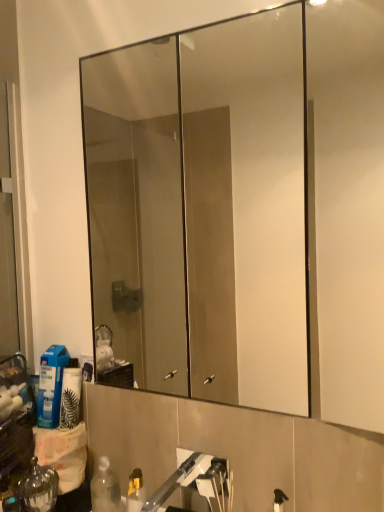
What is the approximate height of brushed metal faucet at lower center?

brushed metal faucet at lower center is 4.20 inches tall.

Describe the element at coordinates (39, 487) in the screenshot. The height and width of the screenshot is (512, 384). I see `shiny metallic bottle at lower left` at that location.

Find the location of a particular element. clear glass mirror at upper center is located at coordinates (203, 210).

Can you confirm if clear glass mirror at upper center is thinner than shiny metallic bottle at lower left?

Correct, the width of clear glass mirror at upper center is less than that of shiny metallic bottle at lower left.

From a real-world perspective, is clear glass mirror at upper center positioned above or below shiny metallic bottle at lower left?

From a real-world perspective, clear glass mirror at upper center is physically above shiny metallic bottle at lower left.

Locate an element on the screen. This screenshot has height=512, width=384. mirror above the shiny metallic bottle at lower left (from the image's perspective) is located at coordinates (203, 210).

From a real-world perspective, is shiny metallic bottle at lower left above or below brushed metal faucet at lower center?

shiny metallic bottle at lower left is situated lower than brushed metal faucet at lower center in the real world.

Looking at this image, what's the angular difference between shiny metallic bottle at lower left and brushed metal faucet at lower center's facing directions?

The facing directions of shiny metallic bottle at lower left and brushed metal faucet at lower center are 2.61 degrees apart.

Based on the photo, which object is positioned more to the right, shiny metallic bottle at lower left or brushed metal faucet at lower center?

From the viewer's perspective, brushed metal faucet at lower center appears more on the right side.

Is shiny metallic bottle at lower left bigger or smaller than brushed metal faucet at lower center?

shiny metallic bottle at lower left is smaller than brushed metal faucet at lower center.

Considering the relative sizes of brushed metal faucet at lower center and blue plastic bottle at lower left in the image provided, is brushed metal faucet at lower center taller than blue plastic bottle at lower left?

No.

From a real-world perspective, which is physically below, brushed metal faucet at lower center or blue plastic bottle at lower left?

brushed metal faucet at lower center, from a real-world perspective.

Which object is closer to the camera, brushed metal faucet at lower center or blue plastic bottle at lower left?

brushed metal faucet at lower center.

Based on their sizes in the image, would you say brushed metal faucet at lower center is bigger or smaller than blue plastic bottle at lower left?

In the image, brushed metal faucet at lower center appears to be larger than blue plastic bottle at lower left.

Find the location of a particular element. Image resolution: width=384 pixels, height=512 pixels. faucet lying below the clear glass mirror at upper center (from the image's perspective) is located at coordinates (178, 479).

In terms of height, does clear glass mirror at upper center look taller or shorter compared to brushed metal faucet at lower center?

In the image, clear glass mirror at upper center appears to be taller than brushed metal faucet at lower center.

From the picture: Can you tell me how much clear glass mirror at upper center and brushed metal faucet at lower center differ in facing direction?

The angular difference between clear glass mirror at upper center and brushed metal faucet at lower center is 1.91 degrees.

From a real-world perspective, which object stands above the other?

From a 3D spatial view, clear glass mirror at upper center is above.

Who is taller, brushed metal faucet at lower center or shiny metallic bottle at lower left?

Standing taller between the two is shiny metallic bottle at lower left.

Looking at this image, is brushed metal faucet at lower center positioned far away from shiny metallic bottle at lower left?

That's not correct — brushed metal faucet at lower center is a little close to shiny metallic bottle at lower left.

You are a GUI agent. You are given a task and a screenshot of the screen. Output one action in this format:
    pyautogui.click(x=<x>, y=<y>)
    Task: Click on the bottle below the brushed metal faucet at lower center (from a real-world perspective)
    The image size is (384, 512).
    Given the screenshot: What is the action you would take?
    pyautogui.click(x=39, y=487)

Which is correct: blue plastic bottle at lower left is inside clear glass mirror at upper center, or outside of it?

blue plastic bottle at lower left cannot be found inside clear glass mirror at upper center.

Does point (61, 369) appear closer or farther from the camera than point (118, 57)?

Point (61, 369) appears to be closer to the viewer than point (118, 57).

Considering the relative positions of blue plastic bottle at lower left and clear glass mirror at upper center in the image provided, is blue plastic bottle at lower left behind clear glass mirror at upper center?

Yes, blue plastic bottle at lower left is behind clear glass mirror at upper center.

Where is `cleaning product that is behind the clear glass mirror at upper center`? cleaning product that is behind the clear glass mirror at upper center is located at coordinates (51, 385).

The image size is (384, 512). In order to click on cleaning product located underneath the clear glass mirror at upper center (from a real-world perspective) in this screenshot , I will do `click(51, 385)`.

Could you tell me if clear glass mirror at upper center is turned towards blue plastic bottle at lower left?

No, clear glass mirror at upper center is not turned towards blue plastic bottle at lower left.

In terms of height, does clear glass mirror at upper center look taller or shorter compared to blue plastic bottle at lower left?

Considering their sizes, clear glass mirror at upper center has more height than blue plastic bottle at lower left.

From a real-world perspective, which object rests below the other?

blue plastic bottle at lower left.

Locate an element on the screen. The height and width of the screenshot is (512, 384). mirror on the right of shiny metallic bottle at lower left is located at coordinates (x=203, y=210).

Where is `bottle located below the brushed metal faucet at lower center (from the image's perspective)`? This screenshot has height=512, width=384. bottle located below the brushed metal faucet at lower center (from the image's perspective) is located at coordinates (39, 487).

Based on their spatial positions, is shiny metallic bottle at lower left or brushed metal faucet at lower center closer to clear glass mirror at upper center?

Based on the image, brushed metal faucet at lower center appears to be nearer to clear glass mirror at upper center.

From the image, which object appears to be nearer to blue plastic bottle at lower left, brushed metal faucet at lower center or shiny metallic bottle at lower left?

shiny metallic bottle at lower left.

Looking at the image, which one is located closer to shiny metallic bottle at lower left, blue plastic bottle at lower left or clear glass mirror at upper center?

Among the two, blue plastic bottle at lower left is located nearer to shiny metallic bottle at lower left.

Estimate the real-world distances between objects in this image. Which object is closer to clear glass mirror at upper center, brushed metal faucet at lower center or shiny metallic bottle at lower left?

brushed metal faucet at lower center.

Based on their spatial positions, is clear glass mirror at upper center or brushed metal faucet at lower center closer to shiny metallic bottle at lower left?

brushed metal faucet at lower center is closer to shiny metallic bottle at lower left.

Considering their positions, is blue plastic bottle at lower left positioned further to shiny metallic bottle at lower left than brushed metal faucet at lower center?

brushed metal faucet at lower center.

From the picture: Based on their spatial positions, is blue plastic bottle at lower left or shiny metallic bottle at lower left further from clear glass mirror at upper center?

Among the two, shiny metallic bottle at lower left is located further to clear glass mirror at upper center.

Considering their positions, is clear glass mirror at upper center positioned closer to brushed metal faucet at lower center than shiny metallic bottle at lower left?

shiny metallic bottle at lower left lies closer to brushed metal faucet at lower center than the other object.

Where is `cleaning product between clear glass mirror at upper center and shiny metallic bottle at lower left vertically`? cleaning product between clear glass mirror at upper center and shiny metallic bottle at lower left vertically is located at coordinates (51, 385).

I want to click on faucet between clear glass mirror at upper center and shiny metallic bottle at lower left from top to bottom, so click(178, 479).

Find the location of `cleaning product between clear glass mirror at upper center and brushed metal faucet at lower center in the vertical direction`. cleaning product between clear glass mirror at upper center and brushed metal faucet at lower center in the vertical direction is located at coordinates (51, 385).

I want to click on bottle between blue plastic bottle at lower left and brushed metal faucet at lower center in the horizontal direction, so (x=39, y=487).